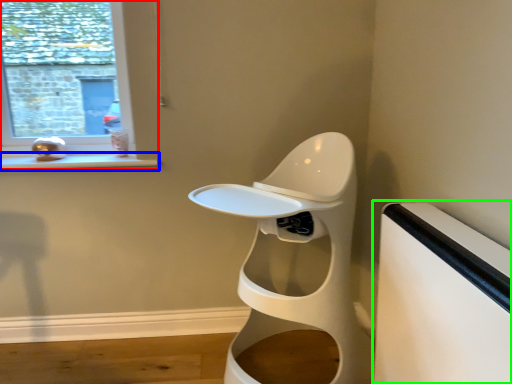
Question: Which object is positioned closest to window (highlighted by a red box)? Select from window sill (highlighted by a blue box) and table (highlighted by a green box).

Choices:
 (A) window sill
 (B) table

Answer: (A)